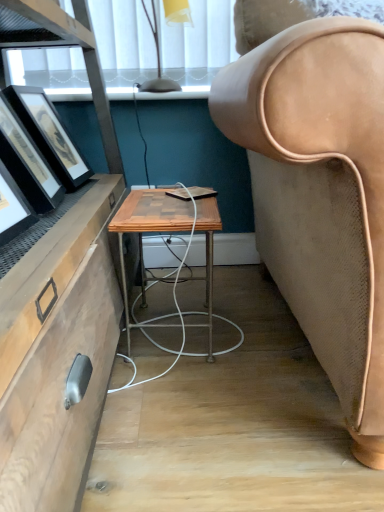
At what (x,y) coordinates should I click in order to perform the action: click on free location above wooden/matte desk at center (from a real-world perspective). Please return your answer as a coordinate pair (x, y). This screenshot has width=384, height=512. Looking at the image, I should click on (171, 206).